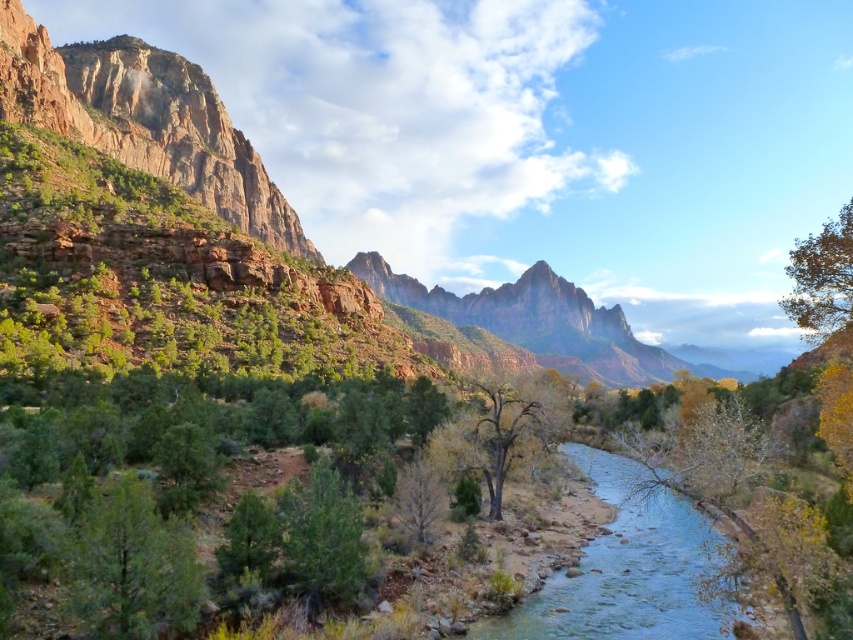
Question: Is green matte tree at lower left bigger than green leafy tree at upper right?

Choices:
 (A) no
 (B) yes

Answer: (A)

Question: Which object appears farthest from the camera in this image?

Choices:
 (A) clear blue water at center
 (B) brown textured tree at center
 (C) green leafy tree at upper right
 (D) green matte tree at lower left

Answer: (B)

Question: Can you confirm if green matte tree at lower left is positioned to the left of brown textured tree at center?

Choices:
 (A) yes
 (B) no

Answer: (A)

Question: Which object is farther from the camera taking this photo?

Choices:
 (A) green leafy tree at upper right
 (B) green matte tree at lower left
 (C) brown textured tree at center
 (D) clear blue water at center

Answer: (C)

Question: Observing the image, what is the correct spatial positioning of green matte tree at lower left in reference to brown textured tree at center?

Choices:
 (A) left
 (B) right

Answer: (A)

Question: Which object is farther from the camera taking this photo?

Choices:
 (A) green matte tree at lower left
 (B) brown textured tree at center
 (C) green leafy tree at upper right

Answer: (B)